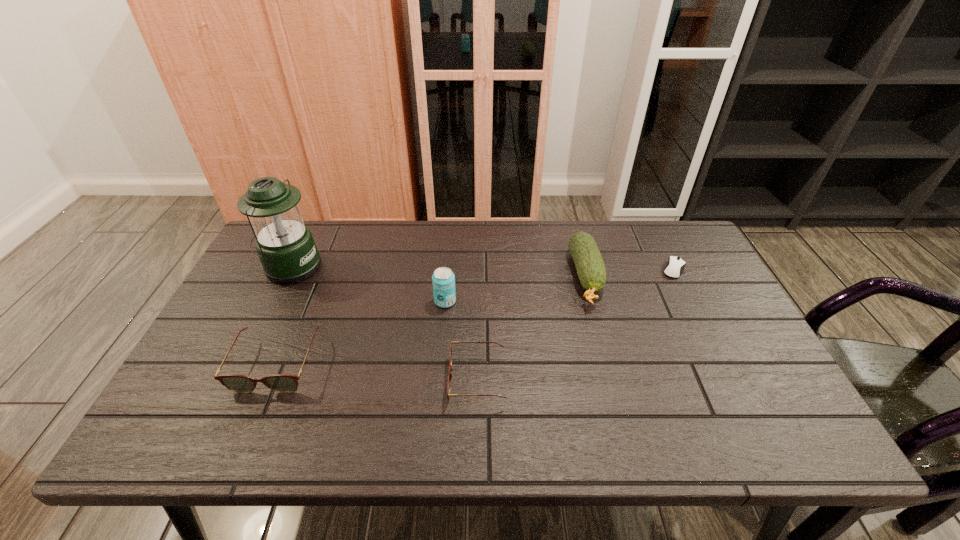
The height and width of the screenshot is (540, 960). I want to click on vacant region at the far left corner, so click(x=312, y=221).

Locate an element on the screen. The image size is (960, 540). vacant space at the far right corner is located at coordinates (665, 238).

You are a GUI agent. You are given a task and a screenshot of the screen. Output one action in this format:
    pyautogui.click(x=<x>, y=<y>)
    Task: Click on the free spot at the near right corner of the desktop
    The image size is (960, 540).
    Given the screenshot: What is the action you would take?
    pyautogui.click(x=744, y=388)

The width and height of the screenshot is (960, 540). In order to click on vacant space that's between the cucumber and the left spectacles in this screenshot , I will do `click(431, 320)`.

What are the coordinates of `unoccupied position between the third tallest object and the second shortest object` in the screenshot? It's located at (532, 328).

The height and width of the screenshot is (540, 960). I want to click on unoccupied position between the taller spectacles and the second tallest object, so click(361, 333).

Find the location of a particular element. This screenshot has width=960, height=540. free space between the right spectacles and the lantern is located at coordinates (384, 323).

The height and width of the screenshot is (540, 960). What are the coordinates of `free space between the beer can and the shorter spectacles` in the screenshot? It's located at (461, 340).

Identify the location of empty space between the taller spectacles and the shorter spectacles. The width and height of the screenshot is (960, 540). (377, 372).

Image resolution: width=960 pixels, height=540 pixels. I want to click on vacant space in between the fourth shortest object and the shorter spectacles, so click(x=532, y=328).